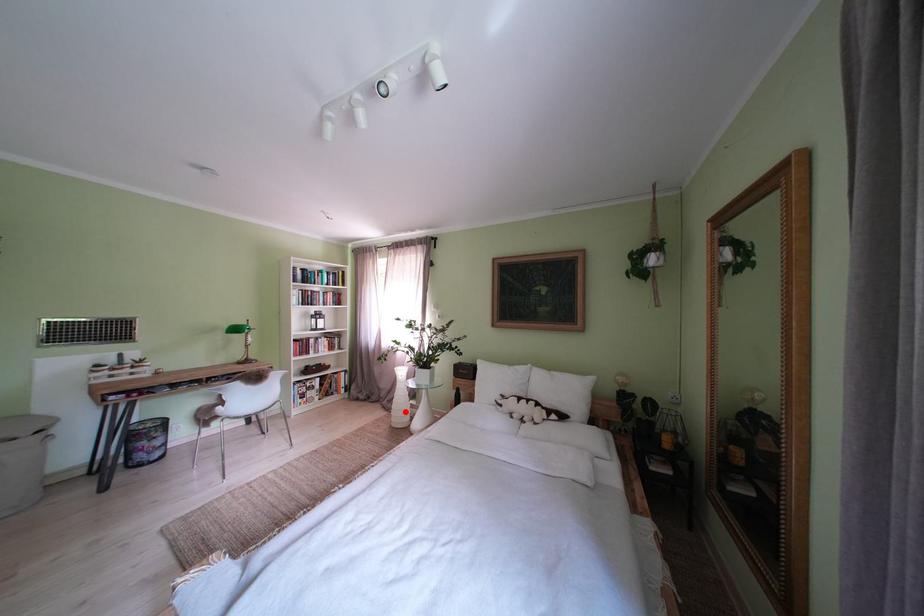
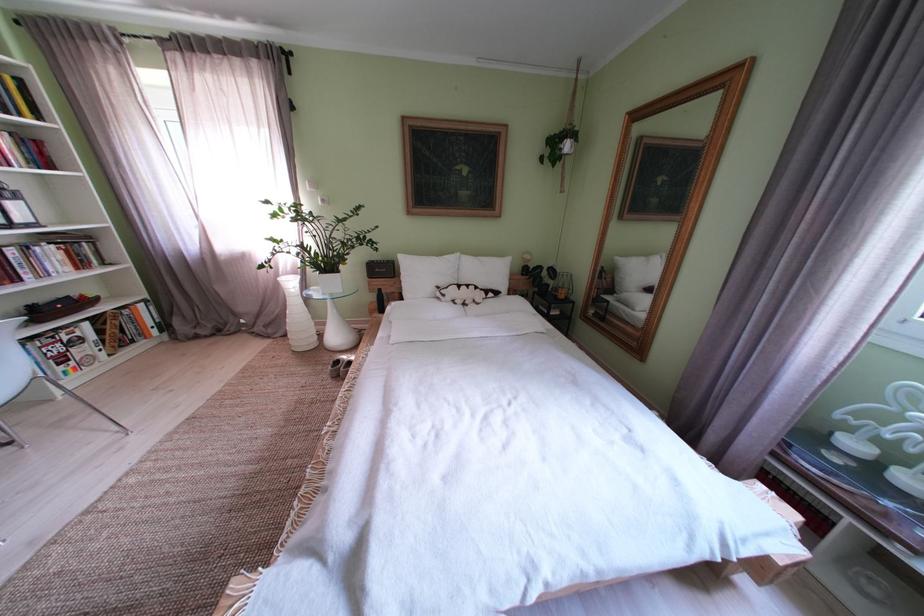
In the second image, find the point that corresponds to the highlighted location in the first image.

(301, 334)